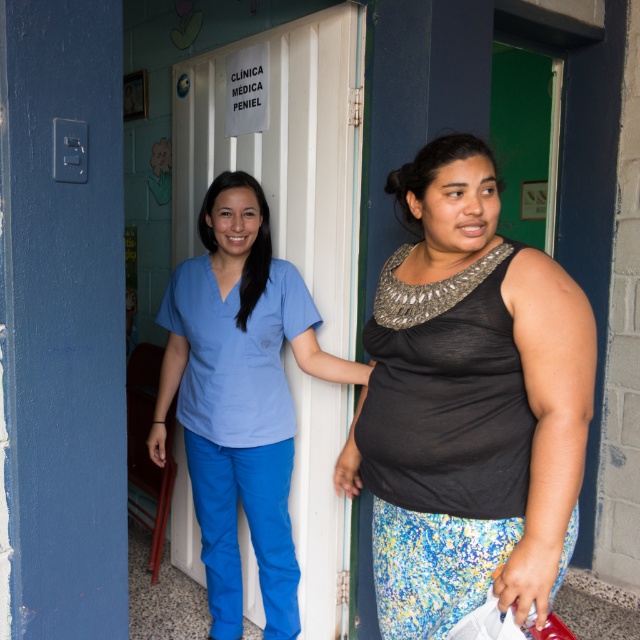
Does black sheer top at center have a smaller size compared to matte blue pants at lower left?

No, black sheer top at center is not smaller than matte blue pants at lower left.

Consider the image. Between black sheer top at center and matte blue pants at lower left, which one appears on the right side from the viewer's perspective?

From the viewer's perspective, black sheer top at center appears more on the right side.

Does point (525, 348) come closer to viewer compared to point (257, 460)?

Yes, it is.

Locate an element on the screen. The image size is (640, 640). black sheer top at center is located at coordinates (468, 403).

Is matte blue scrubs at center below blue fabric scrub at center?

No, matte blue scrubs at center is not below blue fabric scrub at center.

What do you see at coordinates (240, 396) in the screenshot?
I see `matte blue scrubs at center` at bounding box center [240, 396].

What do you see at coordinates (240, 396) in the screenshot? I see `matte blue scrubs at center` at bounding box center [240, 396].

Find the location of `matte blue scrubs at center`. matte blue scrubs at center is located at coordinates (240, 396).

Between matte blue scrubs at center and matte blue pants at lower left, which one appears on the right side from the viewer's perspective?

Positioned to the right is matte blue scrubs at center.

The height and width of the screenshot is (640, 640). Identify the location of matte blue scrubs at center. (240, 396).